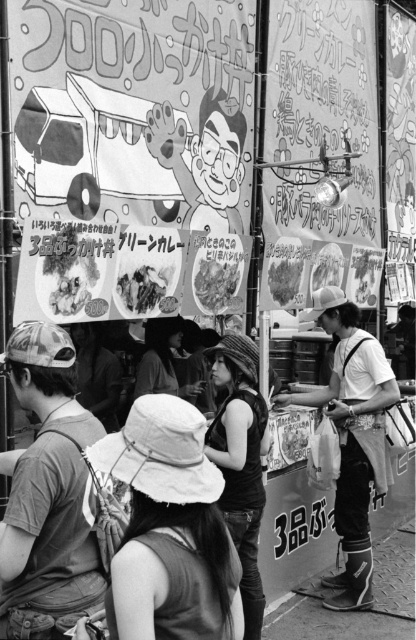
Question: Does metallic silver food truck at upper left have a greater width compared to white fabric apron at right?

Choices:
 (A) yes
 (B) no

Answer: (A)

Question: Which of the following is the farthest from the observer?

Choices:
 (A) (395, 401)
 (B) (146, 154)

Answer: (A)

Question: Can you confirm if metallic silver food truck at upper left is positioned to the right of white fabric apron at right?

Choices:
 (A) no
 (B) yes

Answer: (A)

Question: Can you confirm if metallic silver food truck at upper left is positioned below white fabric apron at right?

Choices:
 (A) yes
 (B) no

Answer: (B)

Question: Among these points, which one is farthest from the camera?

Choices:
 (A) (383, 472)
 (B) (41, 113)

Answer: (A)